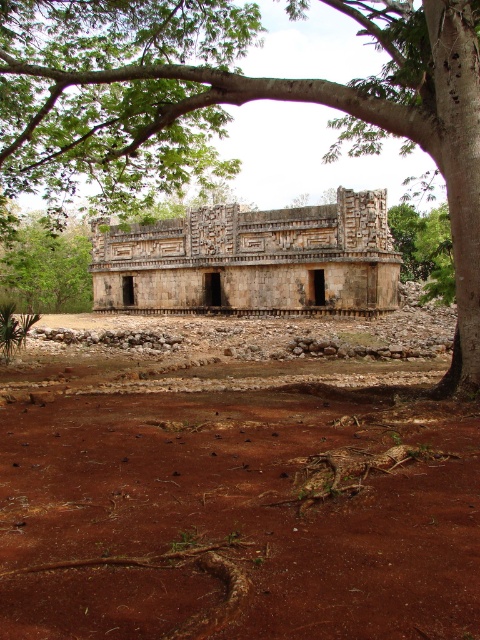
Between point (206, 467) and point (91, 307), which one is positioned behind?

The point (91, 307) is more distant.

Can you confirm if brown soil at center is thinner than green leafy tree at upper left?

Incorrect, brown soil at center's width is not less than green leafy tree at upper left's.

Does point (181, 612) come behind point (86, 296)?

No, it is in front of (86, 296).

Locate an element on the screen. The width and height of the screenshot is (480, 640). brown soil at center is located at coordinates (237, 484).

Does green leafy tree at upper center have a larger size compared to green leafy tree at upper left?

Correct, green leafy tree at upper center is larger in size than green leafy tree at upper left.

Is green leafy tree at upper center to the left of green leafy tree at upper left from the viewer's perspective?

In fact, green leafy tree at upper center is to the right of green leafy tree at upper left.

This screenshot has height=640, width=480. What do you see at coordinates (239, 99) in the screenshot? I see `green leafy tree at upper center` at bounding box center [239, 99].

Locate an element on the screen. The width and height of the screenshot is (480, 640). green leafy tree at upper center is located at coordinates (239, 99).

Can you confirm if brown soil at center is taller than stone textured temple at center?

No.

From the picture: Is brown soil at center closer to camera compared to stone textured temple at center?

Yes, brown soil at center is in front of stone textured temple at center.

Where is `brown soil at center`? brown soil at center is located at coordinates (237, 484).